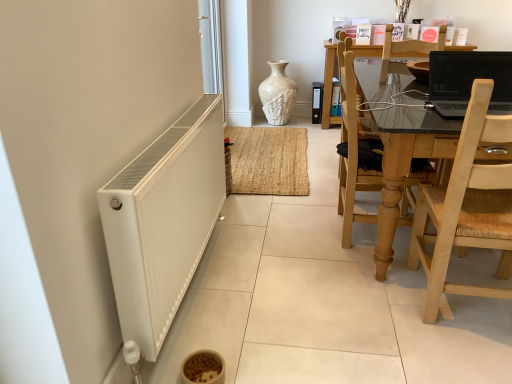
Find the location of a particular element. The width and height of the screenshot is (512, 384). vacant region to the right of white matte radiator at lower left is located at coordinates (304, 293).